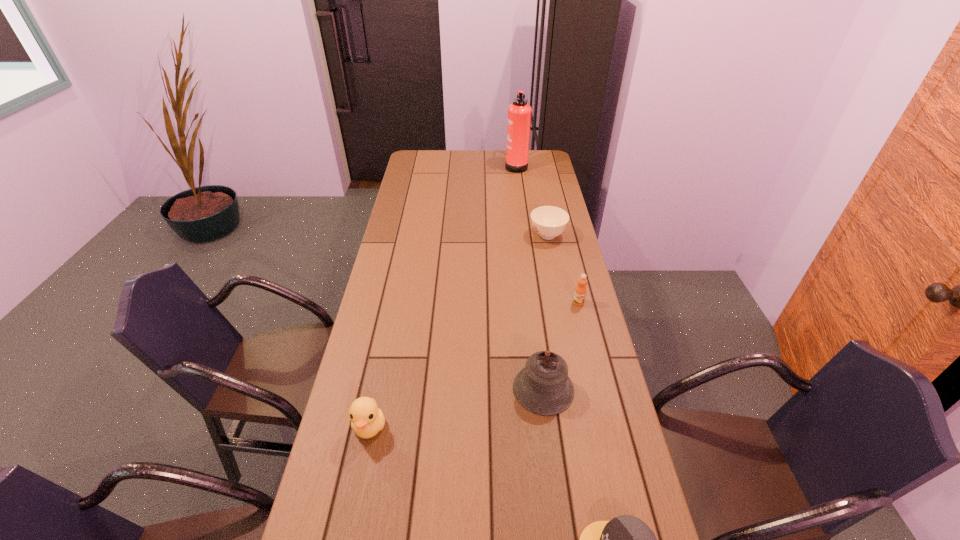
Where is `the farthest object`? The width and height of the screenshot is (960, 540). the farthest object is located at coordinates (519, 113).

This screenshot has height=540, width=960. In order to click on the tallest object in this screenshot , I will do `click(519, 113)`.

You are a GUI agent. You are given a task and a screenshot of the screen. Output one action in this format:
    pyautogui.click(x=<x>, y=<y>)
    Task: Click on the bell
    The image size is (960, 540).
    Given the screenshot: What is the action you would take?
    pyautogui.click(x=543, y=387)

You are a GUI agent. You are given a task and a screenshot of the screen. Output one action in this format:
    pyautogui.click(x=<x>, y=<y>)
    Task: Click on the third farthest object
    
    Given the screenshot: What is the action you would take?
    pyautogui.click(x=580, y=291)

Where is `the leftmost object`? The image size is (960, 540). the leftmost object is located at coordinates pos(367,419).

This screenshot has height=540, width=960. What are the coordinates of `the second shortest object` in the screenshot? It's located at (548, 222).

The image size is (960, 540). I want to click on sugar bowl, so click(548, 222).

Locate an element on the screen. free space located at the nozzle of the fire extinguisher is located at coordinates (455, 165).

Find the location of a particular element. free location located at the nozzle of the fire extinguisher is located at coordinates (440, 165).

Find the location of a particular element. This screenshot has width=960, height=540. vacant space positioned at the nozzle of the fire extinguisher is located at coordinates (495, 165).